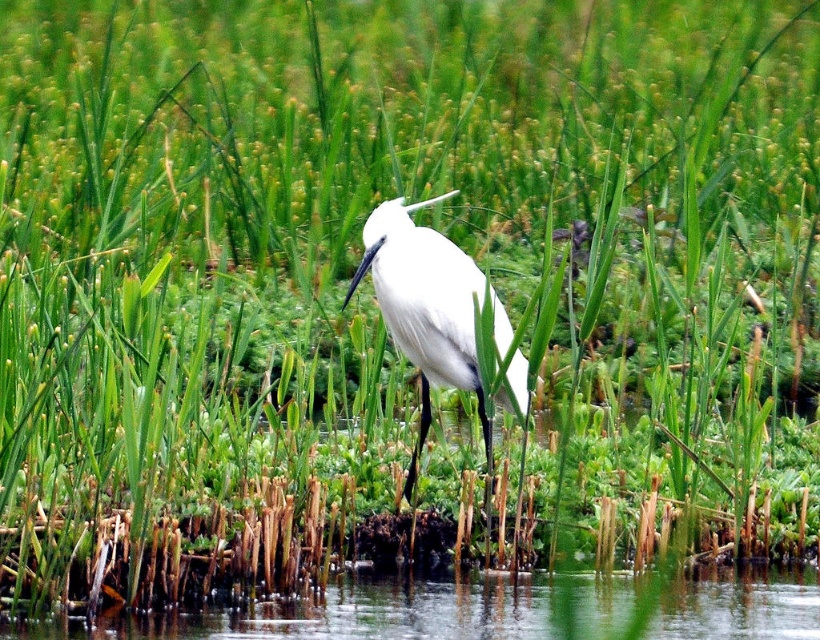
You are a photographer trying to capture the white matte bird at center in the wetland scene. You notice the transparent water at lower center might interfere with your shot. Can you adjust your position to focus on the bird without the water being in the foreground?

The transparent water at lower center is closer to the viewer than the white matte bird at center. To avoid the water being in the foreground, you should adjust your position to move either to the left or right of the current viewpoint so that the bird is no longer behind the water.

You are standing in the wetland scene and want to find the transparent water at lower center. According to the coordinates provided, where exactly should you look?

The transparent water at lower center is located at point coordinates of 0.955 on the x axis and 0.610 on the y axis.